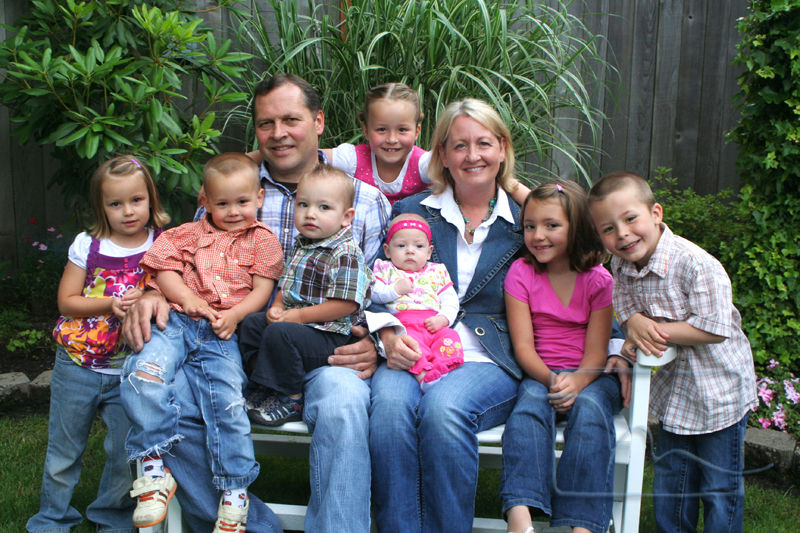
The width and height of the screenshot is (800, 533). What are the coordinates of `white bench` in the screenshot? It's located at (630, 446), (177, 526), (293, 432).